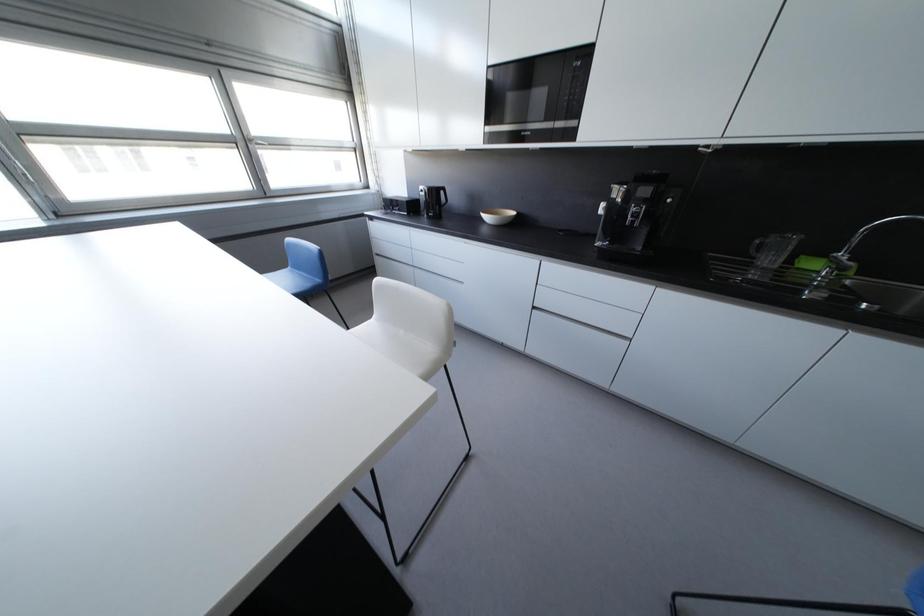
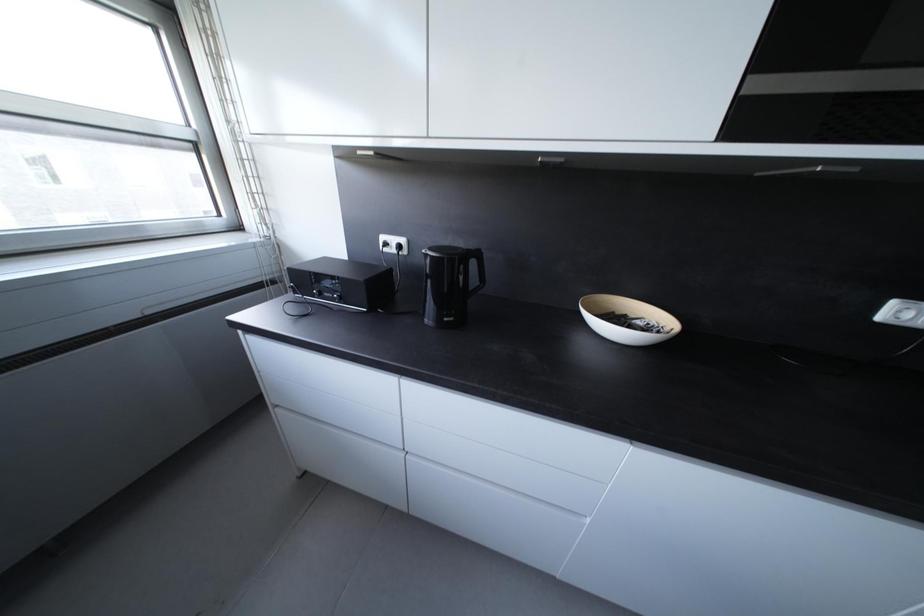
Which direction would the cameraman need to move to produce the second image?

The cameraman walked toward left, forward.